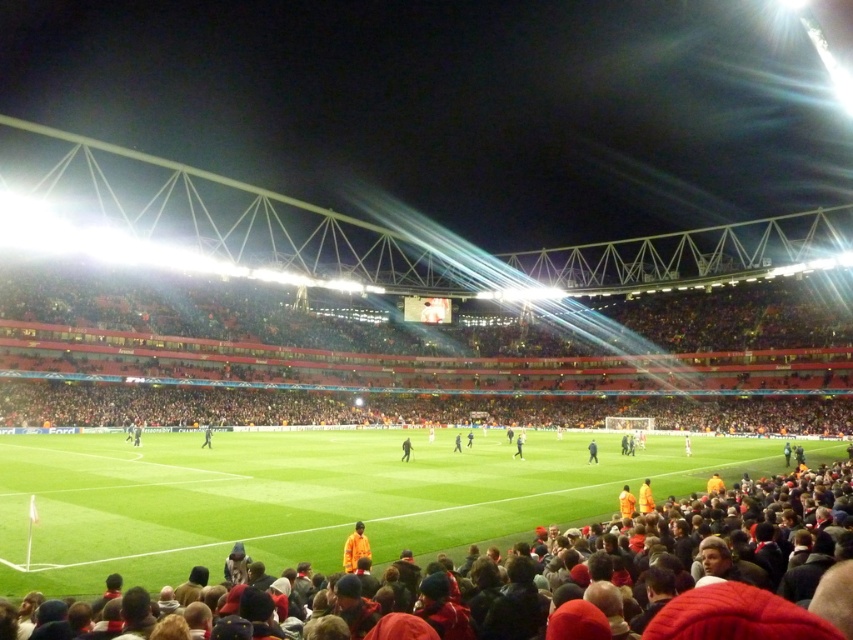
Is green grass at center positioned at the back of orange fabric person at center?

No, it is in front of orange fabric person at center.

Can you confirm if green grass at center is positioned to the right of orange fabric person at center?

Yes, green grass at center is to the right of orange fabric person at center.

Which is in front, point (566, 477) or point (210, 444)?

Positioned in front is point (566, 477).

This screenshot has width=853, height=640. I want to click on green grass at center, so click(311, 497).

Is orange waterproof jacket at lower center smaller than dark brown leather jacket at center?

Indeed, orange waterproof jacket at lower center has a smaller size compared to dark brown leather jacket at center.

Locate an element on the screen. The image size is (853, 640). orange waterproof jacket at lower center is located at coordinates (355, 547).

Is point (515, 445) closer to viewer compared to point (456, 440)?

That is False.

Which is in front, point (518, 451) or point (457, 448)?

Point (518, 451)

Does point (519, 452) lie behind point (453, 445)?

No, it is in front of (453, 445).

Where is `black fabric person at center`? This screenshot has height=640, width=853. black fabric person at center is located at coordinates (518, 445).